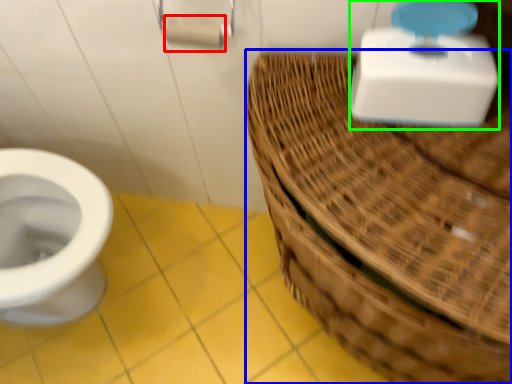
Question: Based on their relative distances, which object is nearer to toilet paper (highlighted by a red box)? Choose from basket (highlighted by a blue box) and scale (highlighted by a green box).

Choices:
 (A) basket
 (B) scale

Answer: (B)